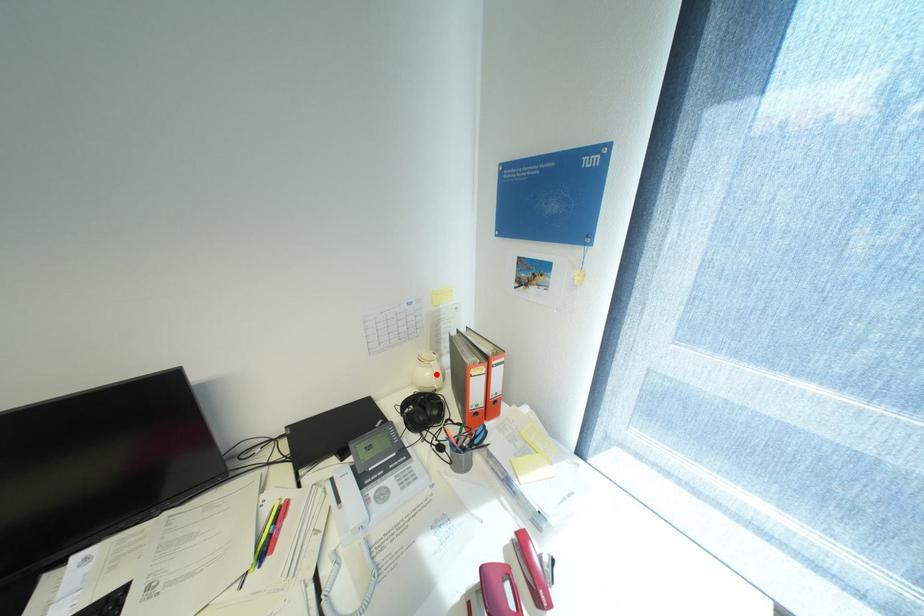
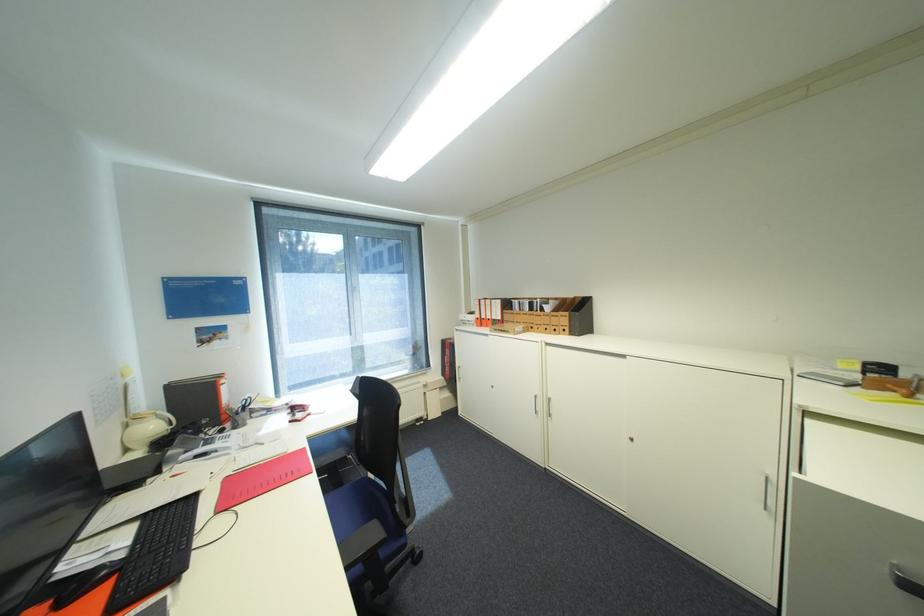
Question: I am providing you with two images of the same scene from different viewpoints. A red point is marked on the first image. At the location where the point appears in image 1, is it still visible in image 2?

Choices:
 (A) Yes
 (B) No

Answer: (A)